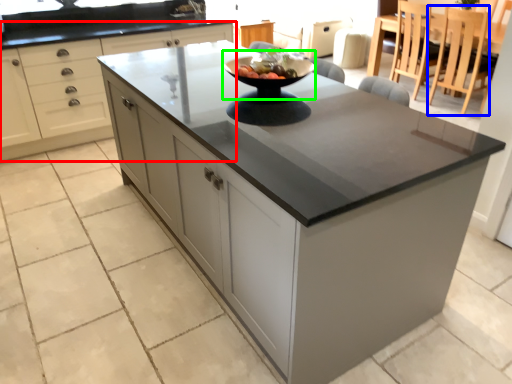
Question: Estimate the real-world distances between objects in this image. Which object is farther from cabinetry (highlighted by a red box), chair (highlighted by a blue box) or mixing bowl (highlighted by a green box)?

Choices:
 (A) chair
 (B) mixing bowl

Answer: (A)